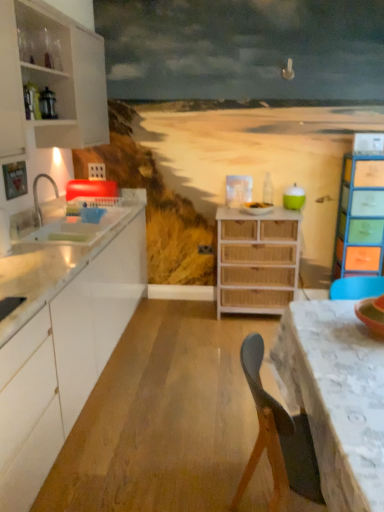
Question: Looking at their shapes, would you say white glossy cabinet at left, positioned as the 1th cabinetry in bottom-to-top order, is wider or thinner than white glossy sink at left?

Choices:
 (A) wide
 (B) thin

Answer: (A)

Question: Considering the positions of white glossy cabinet at left, which appears as the 2th cabinetry when viewed from the top, and white glossy sink at left in the image, is white glossy cabinet at left, which appears as the 2th cabinetry when viewed from the top, taller or shorter than white glossy sink at left?

Choices:
 (A) short
 (B) tall

Answer: (B)

Question: Estimate the real-world distances between objects in this image. Which object is closer to the white glossy cabinet at left, positioned as the 1th cabinetry in bottom-to-top order?

Choices:
 (A) white lace tablecloth at lower right
 (B) white glossy sink at left
 (C) woven wood chest of drawers at center, which ranks as the 2th chest of drawers in right-to-left order
 (D) multicolored wicker chest of drawers at right, which is the 2th chest of drawers from left to right
 (E) white matte cabinet at left, marked as the first cabinetry in a top-to-bottom arrangement

Answer: (B)

Question: Estimate the real-world distances between objects in this image. Which object is closer to the white lace tablecloth at lower right?

Choices:
 (A) multicolored wicker chest of drawers at right, which is the 2th chest of drawers from left to right
 (B) white matte cabinet at left, marked as the first cabinetry in a top-to-bottom arrangement
 (C) white glossy cabinet at left, positioned as the 1th cabinetry in bottom-to-top order
 (D) woven wood chest of drawers at center, which is the first chest of drawers from left to right
 (E) white glossy sink at left

Answer: (C)